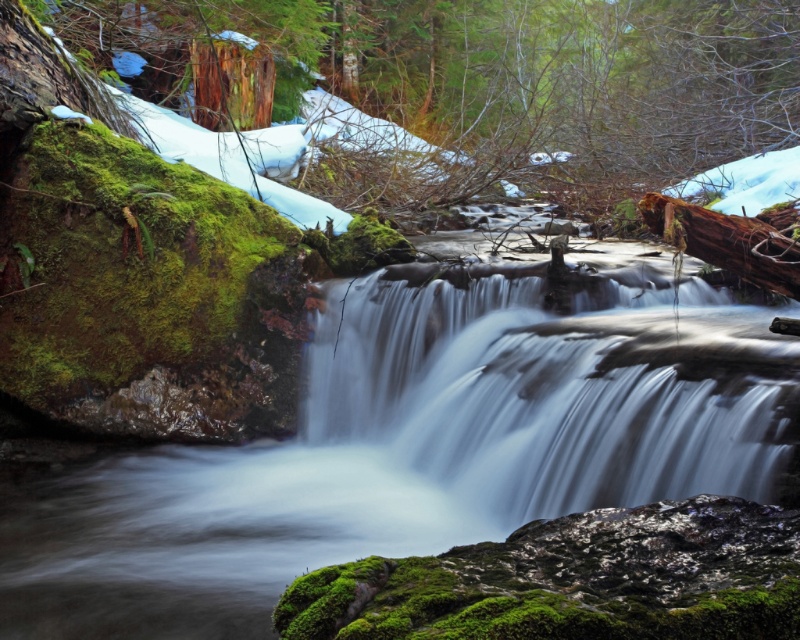
Question: Which is nearer to the brown rough log at upper center?

Choices:
 (A) green mossy rock at center
 (B) green mossy rock at upper left
 (C) white smooth waterfall at center

Answer: (C)

Question: Which point appears closest to the camera in this image?

Choices:
 (A) (652, 161)
 (B) (748, 230)
 (C) (26, 600)
 (D) (717, 461)

Answer: (C)

Question: Is green mossy rock at center smaller than green mossy rock at upper left?

Choices:
 (A) yes
 (B) no

Answer: (A)

Question: Is the position of green mossy rock at center less distant than that of white smooth waterfall at center?

Choices:
 (A) yes
 (B) no

Answer: (A)

Question: Which point appears farthest from the camera in this image?

Choices:
 (A) (686, 442)
 (B) (398, 420)
 (C) (172, 108)

Answer: (C)

Question: Observing the image, what is the correct spatial positioning of green mossy rock at center in reference to green mossy rock at upper left?

Choices:
 (A) left
 (B) right

Answer: (A)